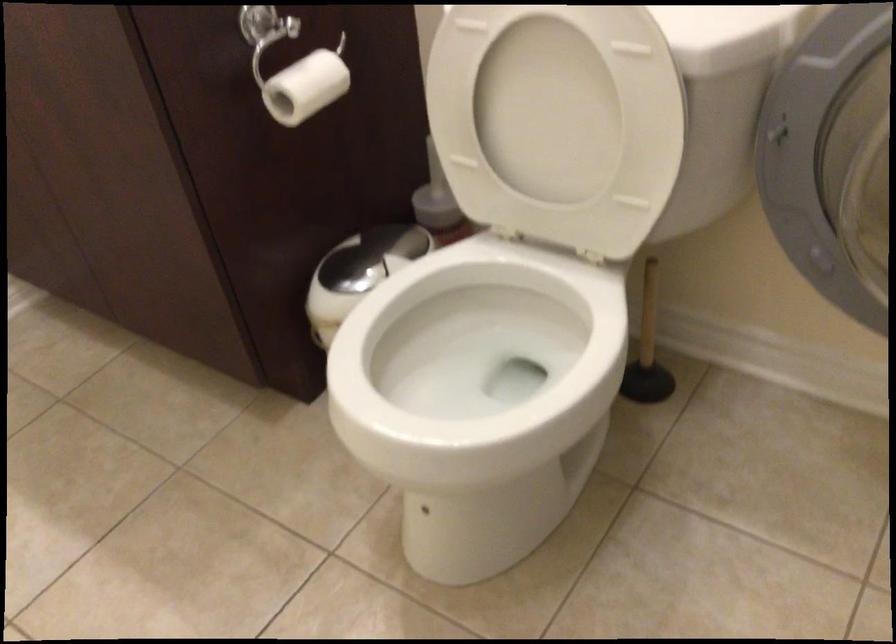
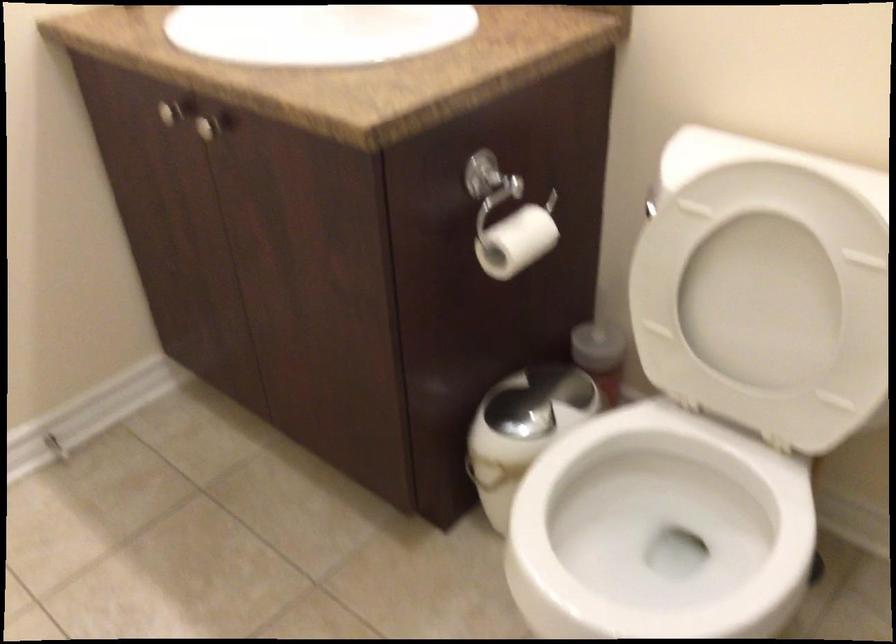
Question: In a continuous first-person perspective shot, in which direction is the camera moving?

Choices:
 (A) Left
 (B) Right
 (C) Forward
 (D) Backward

Answer: (A)